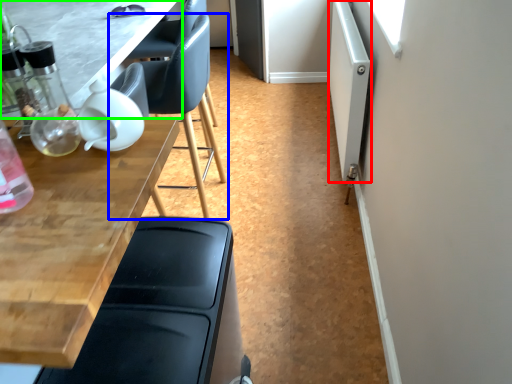
Question: Considering the real-world distances, which object is closest to screen door (highlighted by a red box)? chair (highlighted by a blue box) or table (highlighted by a green box).

Choices:
 (A) chair
 (B) table

Answer: (A)